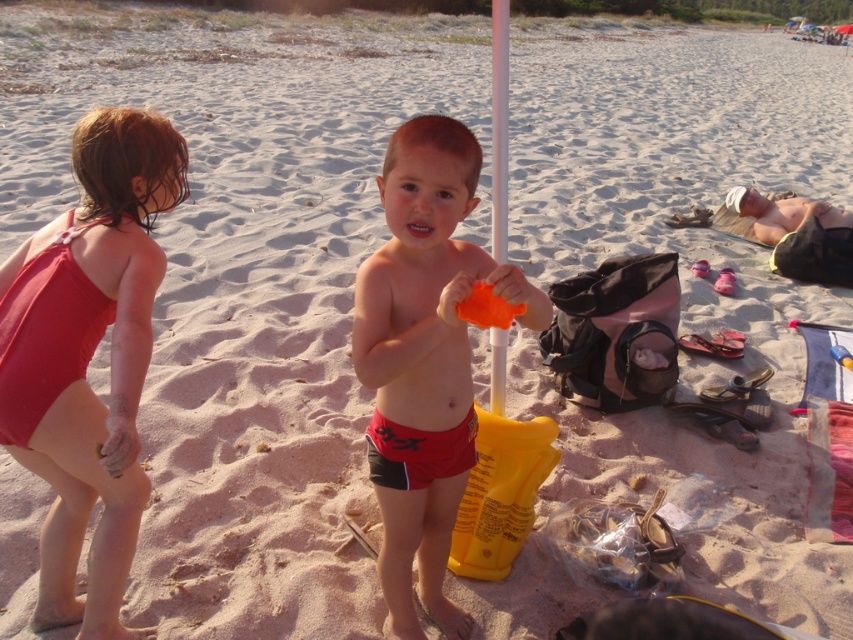
Question: Among these points, which one is farthest from the camera?

Choices:
 (A) (506, 22)
 (B) (776, 230)
 (C) (53, 332)
 (D) (381, 570)

Answer: (B)

Question: Which object is closer to the camera taking this photo?

Choices:
 (A) beige fabric towel at right
 (B) matte red swimsuit at left

Answer: (B)

Question: Can you confirm if matte red shorts at center is positioned above orange plastic pole at center?

Choices:
 (A) yes
 (B) no

Answer: (B)

Question: Considering the real-world distances, which object is farthest from the orange plastic pole at center?

Choices:
 (A) beige fabric towel at right
 (B) matte red shorts at center
 (C) matte red swimsuit at left

Answer: (A)

Question: Does matte red swimsuit at left have a greater width compared to matte red shorts at center?

Choices:
 (A) no
 (B) yes

Answer: (B)

Question: Is the position of matte red swimsuit at left more distant than that of matte red shorts at center?

Choices:
 (A) yes
 (B) no

Answer: (A)